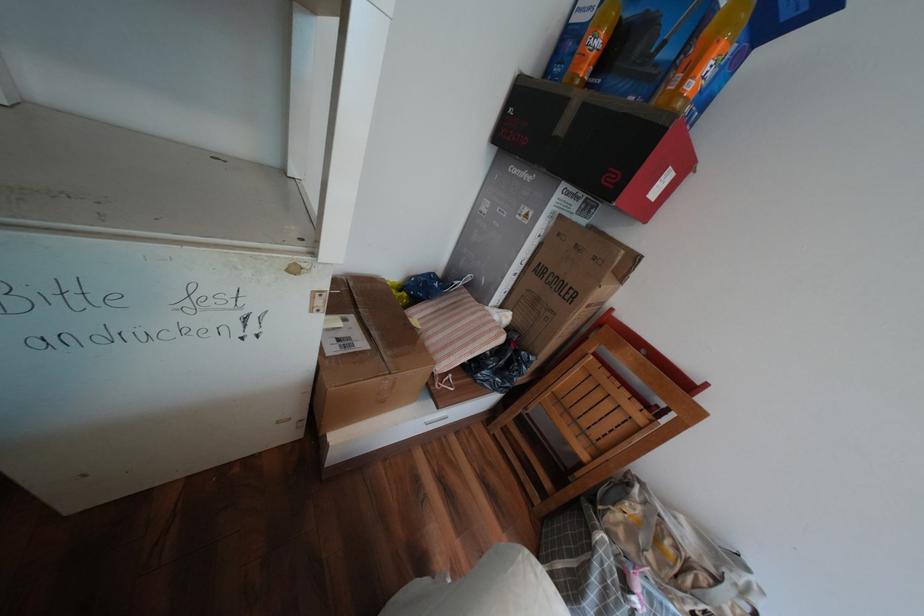
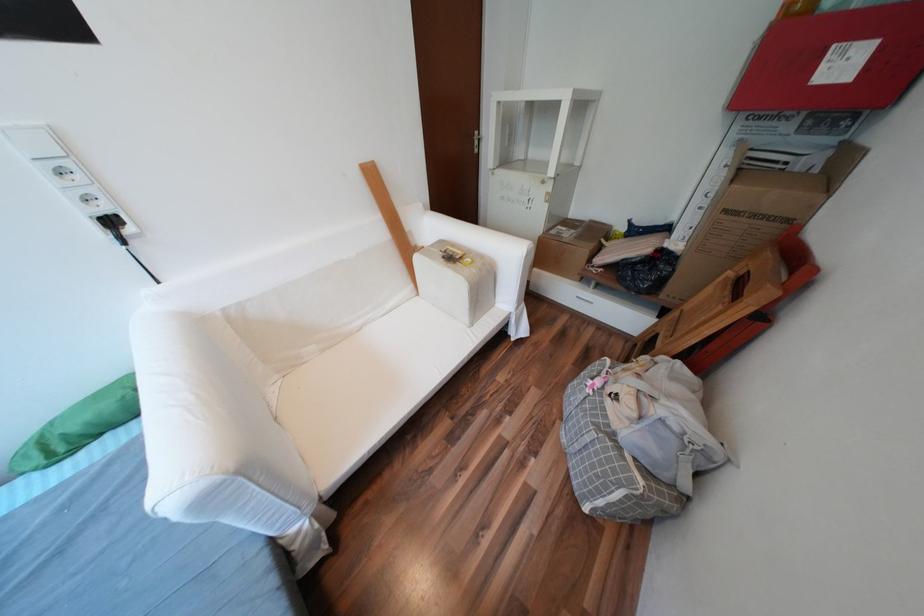
Find the pixel in the second image that matches point 621,572 in the first image.

(602, 371)